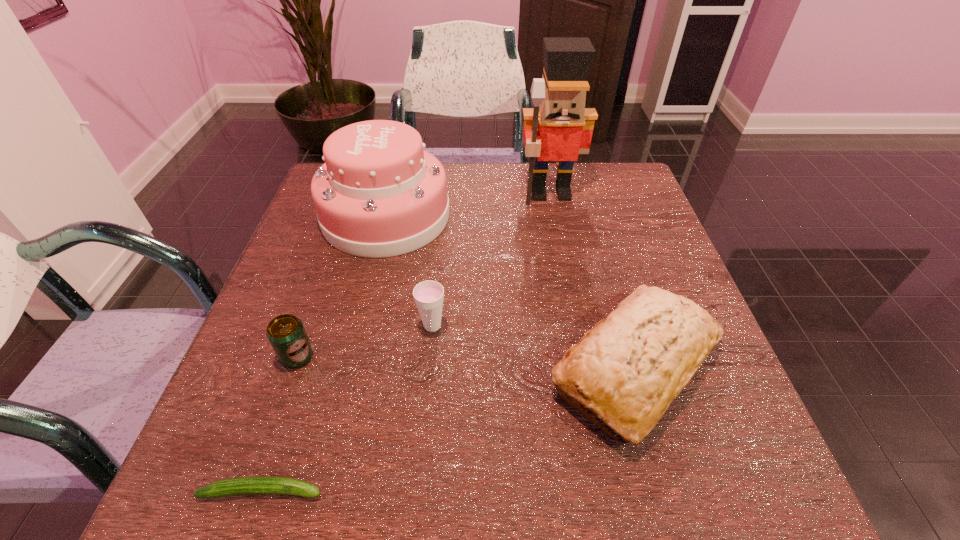
Where is `free area in between the cup and the tallest object`? This screenshot has height=540, width=960. free area in between the cup and the tallest object is located at coordinates (492, 260).

Find the location of a particular element. This screenshot has width=960, height=540. object identified as the closest to the nearest object is located at coordinates (286, 333).

Locate which object ranks fourth in proximity to the shortest object. Please provide its 2D coordinates. Your answer should be formatted as a tuple, i.e. [(x, y)], where the tuple contains the x and y coordinates of a point satisfying the conditions above.

[(379, 194)]

Where is `vacant area in the image that satisfies the following two spatial constraints: 1. on the front side of the cake; 2. on the left side of the cup`? vacant area in the image that satisfies the following two spatial constraints: 1. on the front side of the cake; 2. on the left side of the cup is located at coordinates (359, 326).